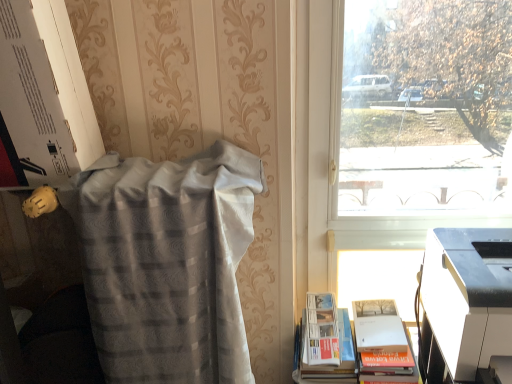
Question: Is white plastic printer at lower right in front of or behind transparent glass window at upper right in the image?

Choices:
 (A) front
 (B) behind

Answer: (A)

Question: Is white plastic printer at lower right to the left or to the right of transparent glass window at upper right in the image?

Choices:
 (A) left
 (B) right

Answer: (B)

Question: Which of these objects is positioned closest to the silvery textured blanket at left?

Choices:
 (A) transparent glass window at upper right
 (B) white paperback book at lower right
 (C) white plastic printer at lower right

Answer: (B)

Question: Based on their relative distances, which object is farther from the white plastic printer at lower right?

Choices:
 (A) white paperback book at lower right
 (B) silvery textured blanket at left
 (C) transparent glass window at upper right

Answer: (C)